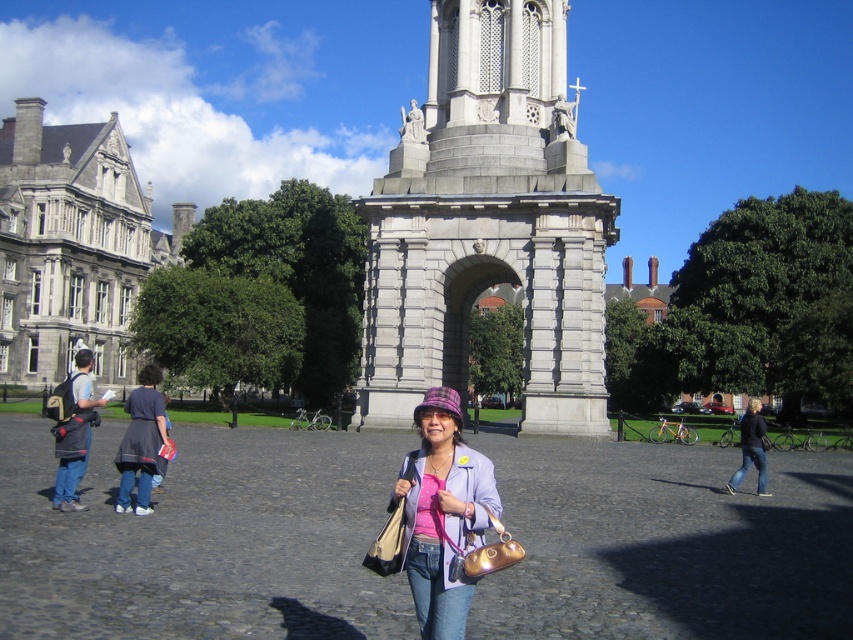
Question: Is the position of denim jacket at left less distant than that of denim jeans at lower right?

Choices:
 (A) no
 (B) yes

Answer: (B)

Question: Does pink fabric hat at center appear over denim jeans at lower right?

Choices:
 (A) no
 (B) yes

Answer: (B)

Question: Among these objects, which one is farthest from the camera?

Choices:
 (A) denim jeans at lower right
 (B) dark blue dress at left
 (C) pink fabric hat at center
 (D) denim jacket at left

Answer: (A)

Question: Is denim jacket at left below denim jeans at lower right?

Choices:
 (A) no
 (B) yes

Answer: (A)

Question: Which point appears closest to the camera in this image?

Choices:
 (A) (758, 436)
 (B) (479, 509)
 (C) (561, 326)

Answer: (B)

Question: Which object is farther from the camera taking this photo?

Choices:
 (A) denim jacket at left
 (B) gray stone monument at center
 (C) dark blue dress at left
 (D) pink fabric hat at center

Answer: (B)